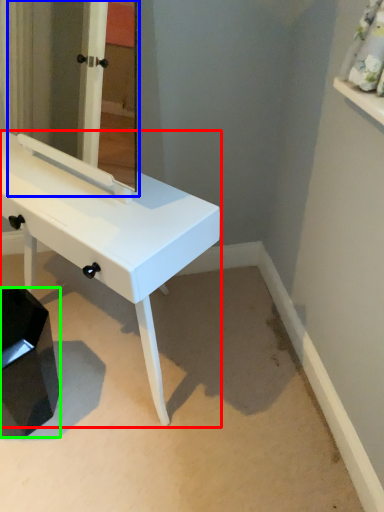
Question: Which object is the farthest from table (highlighted by a red box)? Choose among these: mirror (highlighted by a blue box) or step stool (highlighted by a green box).

Choices:
 (A) mirror
 (B) step stool

Answer: (A)